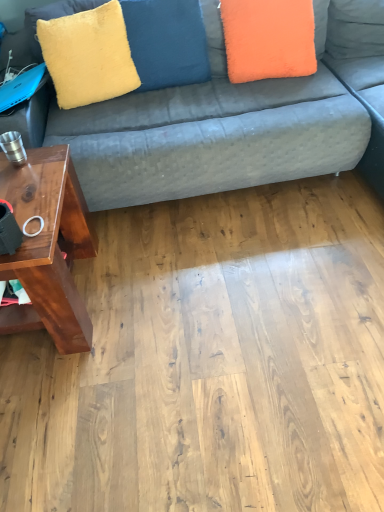
Question: Considering the relative positions of brown wood table at left and velvet fabric couch at upper center in the image provided, is brown wood table at left to the left or to the right of velvet fabric couch at upper center?

Choices:
 (A) left
 (B) right

Answer: (A)

Question: Is point (23, 202) closer or farther from the camera than point (319, 74)?

Choices:
 (A) closer
 (B) farther

Answer: (A)

Question: Considering the real-world distances, which object is closest to the velvet fabric couch at upper center?

Choices:
 (A) brown wood table at left
 (B) yellow plush pillow at upper center, acting as the 1th pillow starting from the left
 (C) orange fuzzy pillow at upper right, acting as the second pillow starting from the left
 (D) yellow fuzzy pillow at upper left

Answer: (C)

Question: Which is farther from the yellow plush pillow at upper center, positioned as the 2th pillow in right-to-left order?

Choices:
 (A) brown wood table at left
 (B) velvet fabric couch at upper center
 (C) orange fuzzy pillow at upper right, the 1th pillow in the right-to-left sequence
 (D) yellow fuzzy pillow at upper left

Answer: (A)